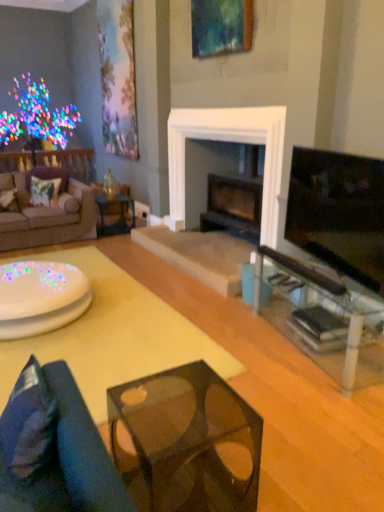
The width and height of the screenshot is (384, 512). I want to click on free point below translucent glass cube at center, the second table in the right-to-left sequence (from a real-world perspective), so click(182, 494).